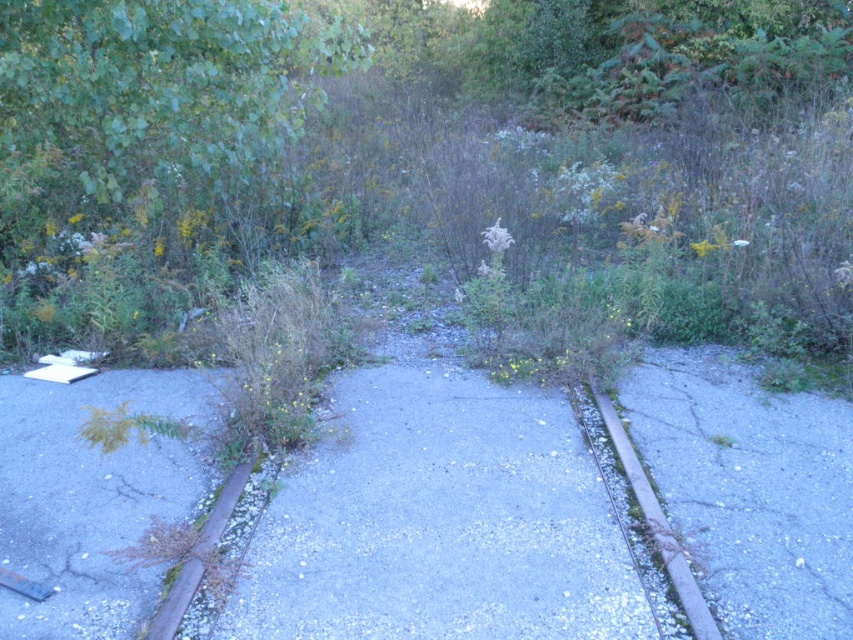
Question: Which object appears closest to the camera in this image?

Choices:
 (A) rusty metal curb at lower right
 (B) gray concrete pavement at center

Answer: (A)

Question: Which point is closer to the camera?

Choices:
 (A) (602, 406)
 (B) (355, 602)

Answer: (B)

Question: Does gray concrete pavement at center have a smaller size compared to rusty metal curb at lower right?

Choices:
 (A) yes
 (B) no

Answer: (B)

Question: Which object appears farthest from the camera in this image?

Choices:
 (A) gray concrete pavement at center
 (B) rusty metal curb at lower right

Answer: (A)

Question: Is gray concrete pavement at center above rusty metal curb at lower right?

Choices:
 (A) no
 (B) yes

Answer: (B)

Question: In this image, where is gray concrete pavement at center located relative to rusty metal curb at lower right?

Choices:
 (A) below
 (B) above

Answer: (B)